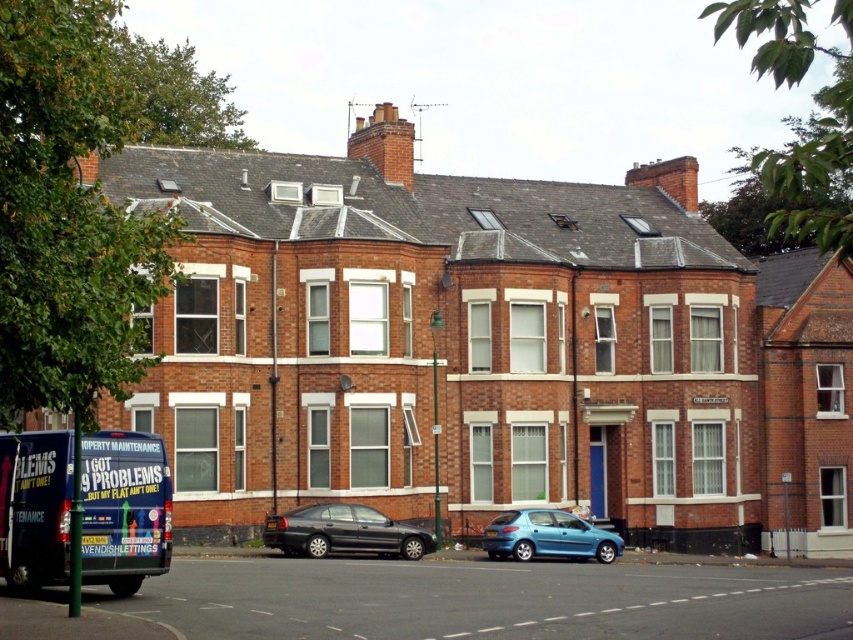
Does shiny black sedan at lower center have a smaller size compared to metallic blue hatchback at center?

Indeed, shiny black sedan at lower center has a smaller size compared to metallic blue hatchback at center.

Does point (321, 545) come farther from viewer compared to point (544, 518)?

No, it is in front of (544, 518).

Is point (354, 509) behind point (509, 531)?

No.

At what (x,y) coordinates should I click in order to perform the action: click on shiny black sedan at lower center. Please return your answer as a coordinate pair (x, y). Looking at the image, I should click on click(x=344, y=532).